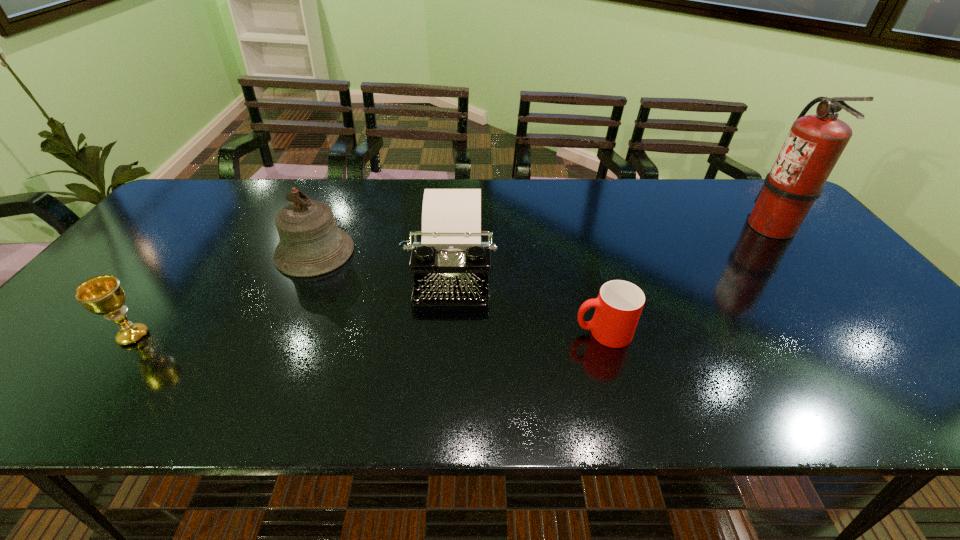
You are a GUI agent. You are given a task and a screenshot of the screen. Output one action in this format:
    pyautogui.click(x=<x>, y=<y>)
    Task: Click on the vacant space located 0.180m toward the nozzle of the tallest object
    Image resolution: width=960 pixels, height=540 pixels.
    Given the screenshot: What is the action you would take?
    pyautogui.click(x=687, y=226)

Find the location of a particular element. This screenshot has width=960, height=540. vacant space located 0.240m on the back of the bell is located at coordinates (344, 187).

At what (x,y) coordinates should I click in order to perform the action: click on free space located on the keys of the typewriter. Please return your answer as a coordinate pair (x, y). Looking at the image, I should click on (442, 388).

This screenshot has height=540, width=960. Find the location of `vacant space located 0.160m on the back of the chalice`. vacant space located 0.160m on the back of the chalice is located at coordinates (178, 278).

This screenshot has height=540, width=960. I want to click on free spot located on the side of the second object from right to left with the handle, so click(426, 333).

What are the coordinates of `vacant space situated on the side of the second object from right to left with the handle` in the screenshot? It's located at (526, 333).

Find the location of `vacant position located on the side of the second object from right to left with the handle`. vacant position located on the side of the second object from right to left with the handle is located at coordinates (474, 333).

Where is `object located in the far edge section of the desktop`? object located in the far edge section of the desktop is located at coordinates (814, 144).

The width and height of the screenshot is (960, 540). What are the coordinates of `object that is at the left edge` in the screenshot? It's located at (x=103, y=295).

Where is `object located in the right edge section of the desktop`? The image size is (960, 540). object located in the right edge section of the desktop is located at coordinates (814, 144).